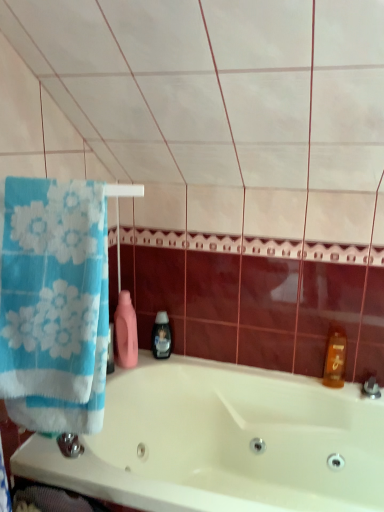
Question: Would you say black plastic soap dispenser at center is to the left or to the right of white glossy bathtub at center in the picture?

Choices:
 (A) right
 (B) left

Answer: (B)

Question: From their relative heights in the image, would you say black plastic soap dispenser at center is taller or shorter than white glossy bathtub at center?

Choices:
 (A) tall
 (B) short

Answer: (B)

Question: Considering the real-world distances, which object is closest to the blue cotton towel at left?

Choices:
 (A) translucent amber bottle at right
 (B) black plastic soap dispenser at center
 (C) white glossy bathtub at center

Answer: (C)

Question: Which object is the closest to the translucent amber bottle at right?

Choices:
 (A) black plastic soap dispenser at center
 (B) blue cotton towel at left
 (C) white glossy bathtub at center

Answer: (C)